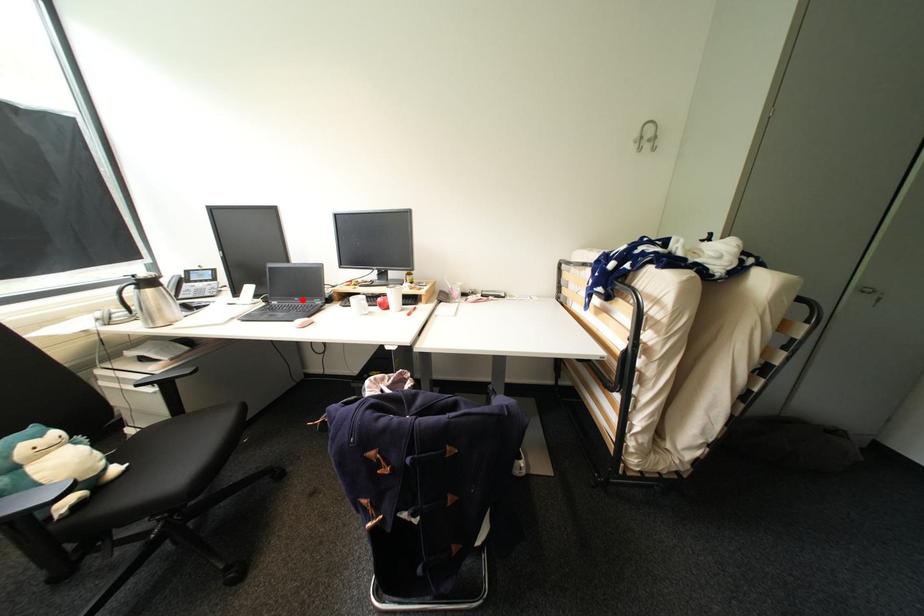
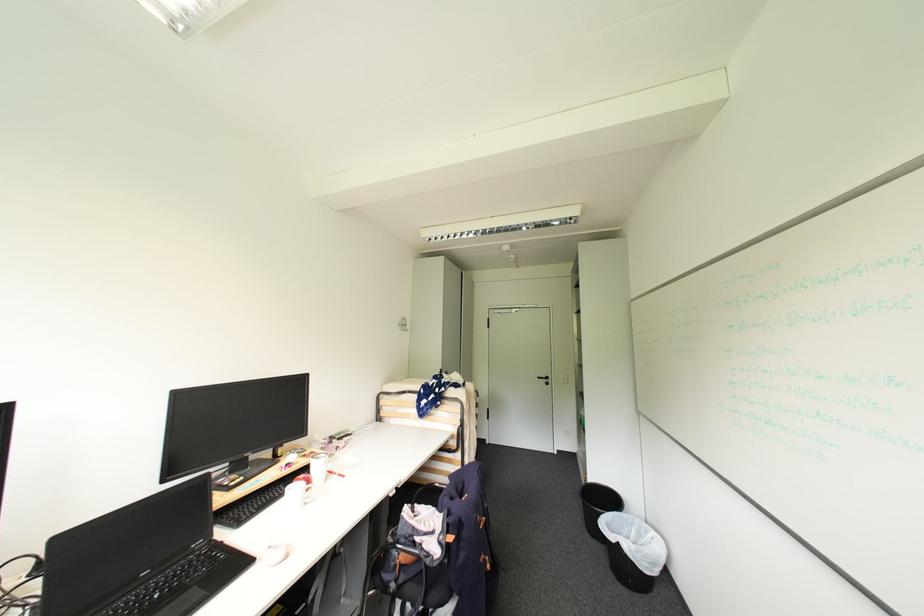
Where in the second image is the point corresponding to the highlighted location from the first image?

(150, 575)